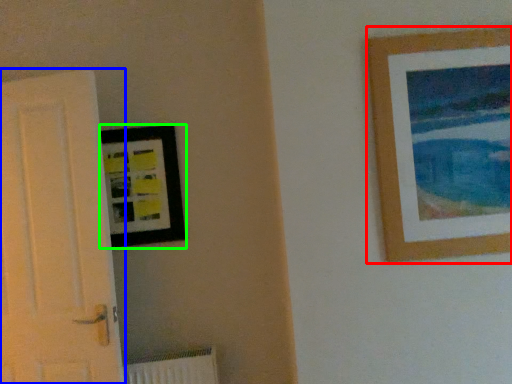
Question: Which is nearer to the picture frame (highlighted by a red box)? door (highlighted by a blue box) or picture frame (highlighted by a green box).

Choices:
 (A) door
 (B) picture frame

Answer: (B)